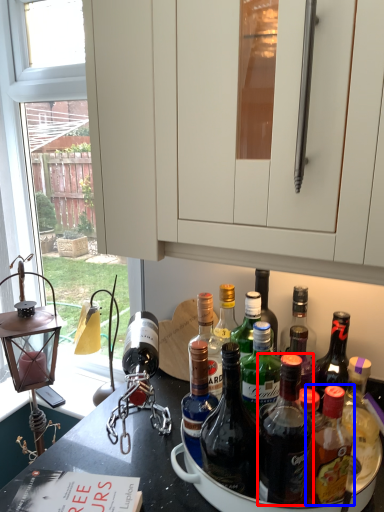
Question: Which point is closer to the camera, bottle (highlighted by a red box) or bottle (highlighted by a blue box)?

Choices:
 (A) bottle
 (B) bottle

Answer: (A)